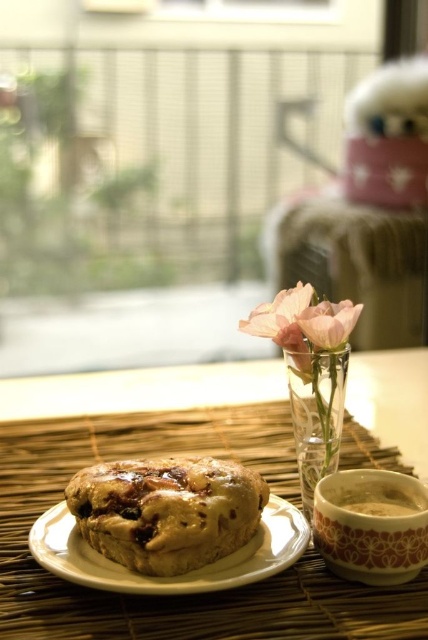
Between white ceramic plate at center and pink matte glass vase at center, which one has more height?

Standing taller between the two is pink matte glass vase at center.

Measure the distance from white ceramic plate at center to pink matte glass vase at center.

A distance of 9.94 inches exists between white ceramic plate at center and pink matte glass vase at center.

Is point (53, 512) more distant than point (341, 333)?

That is True.

Find the location of a particular element. white ceramic plate at center is located at coordinates (177, 576).

Does point (86, 545) come farther from viewer compared to point (306, 419)?

No, it is in front of (306, 419).

Does white ceramic plate at center have a lesser width compared to clear glass vase at center?

No.

Describe the element at coordinates (177, 576) in the screenshot. I see `white ceramic plate at center` at that location.

Where is `white ceramic plate at center`? Image resolution: width=428 pixels, height=640 pixels. white ceramic plate at center is located at coordinates (177, 576).

Who is shorter, golden-brown crumbly muffin at center or pink matte glass vase at center?

With less height is pink matte glass vase at center.

Can you confirm if golden-brown crumbly muffin at center is positioned to the right of pink matte glass vase at center?

No, golden-brown crumbly muffin at center is not to the right of pink matte glass vase at center.

Does point (133, 564) come behind point (314, 308)?

No, it is in front of (314, 308).

I want to click on golden-brown crumbly muffin at center, so click(166, 512).